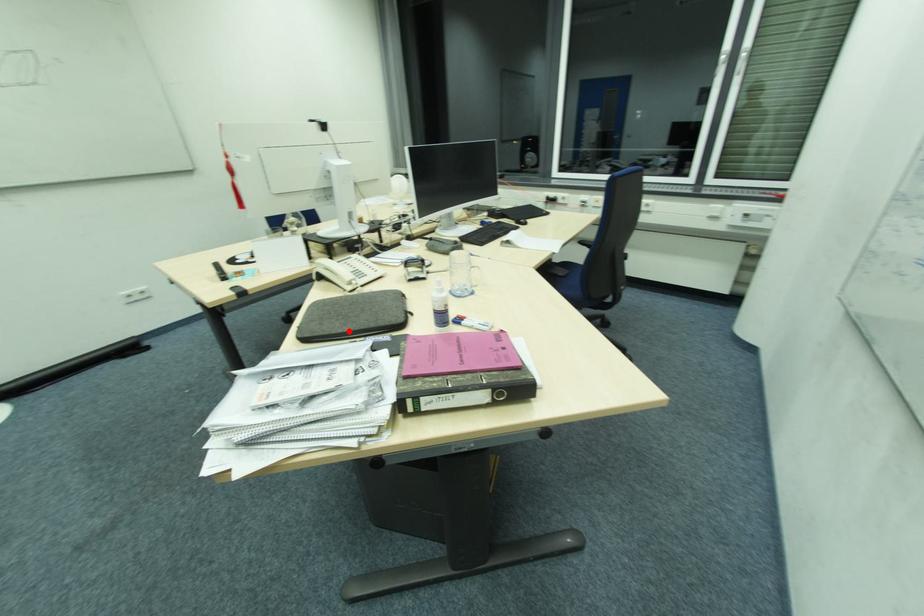
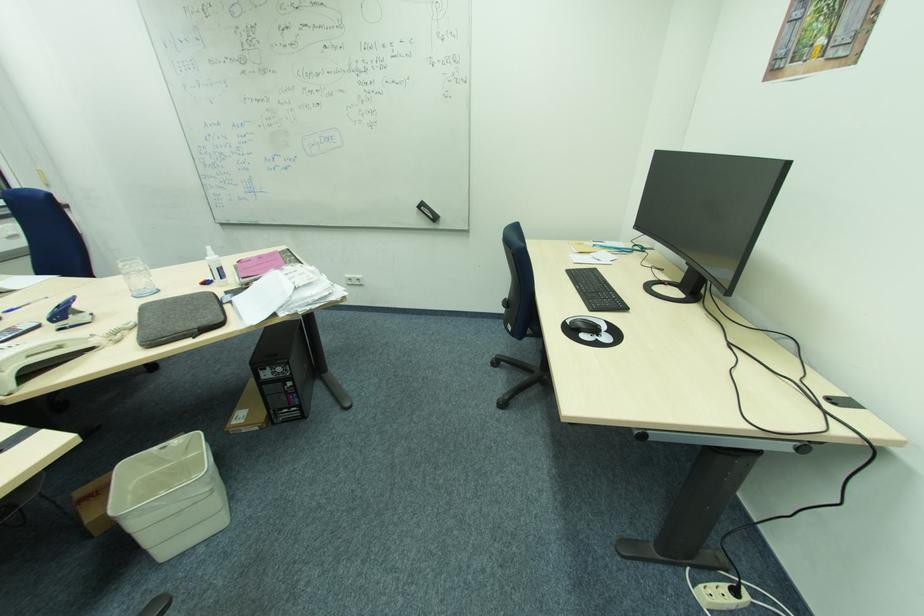
The point at the highlighted location is marked in the first image. Where is the corresponding point in the second image?

(222, 306)